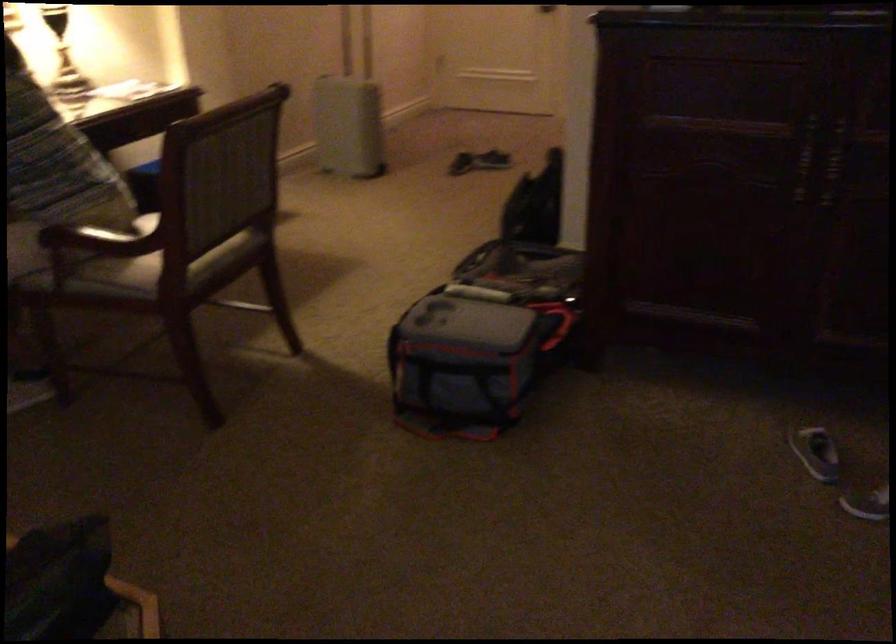
Where would you sit the chair sitting surface? Please return your answer as a coordinate pair (x, y).

(131, 269)